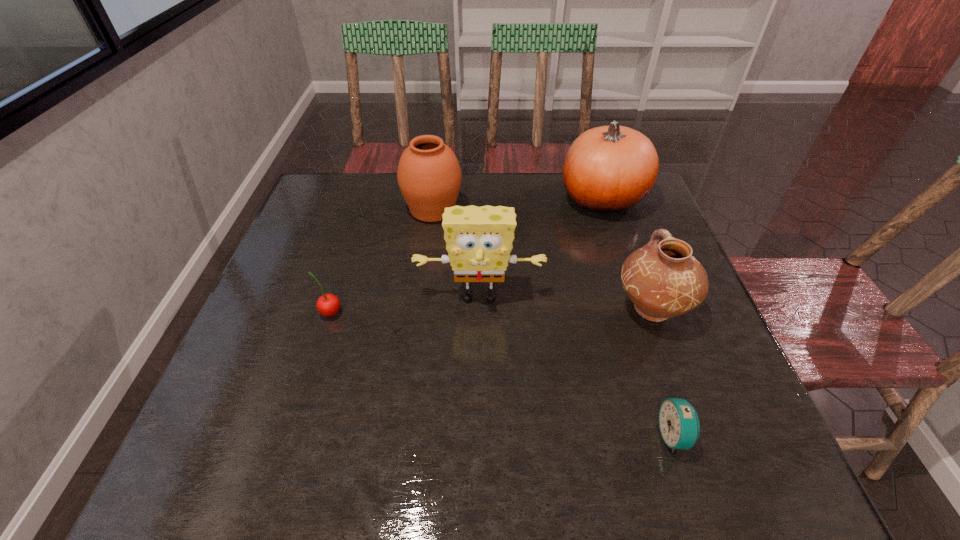
At what (x,y) coordinates should I click in order to perform the action: click on object positioned at the left edge. Please return your answer as a coordinate pair (x, y). This screenshot has height=540, width=960. Looking at the image, I should click on (328, 304).

The width and height of the screenshot is (960, 540). I want to click on pumpkin that is positioned at the right edge, so click(x=607, y=169).

The height and width of the screenshot is (540, 960). In order to click on pottery at the right edge in this screenshot , I will do `click(662, 279)`.

Locate an element on the screen. The image size is (960, 540). alarm clock that is at the right edge is located at coordinates (679, 424).

Find the location of `object at the far right corner`. object at the far right corner is located at coordinates (607, 169).

Locate an element on the screen. object present at the near right corner is located at coordinates (679, 424).

Where is `free space at the far edge of the desktop`? This screenshot has height=540, width=960. free space at the far edge of the desktop is located at coordinates (491, 187).

I want to click on free spot at the near edge of the desktop, so click(x=670, y=482).

The image size is (960, 540). I want to click on vacant space at the left edge of the desktop, so click(299, 241).

You are a GUI agent. You are given a task and a screenshot of the screen. Output one action in this format:
    pyautogui.click(x=<x>, y=<y>)
    Task: Click on the free space at the right edge
    Image resolution: width=960 pixels, height=540 pixels.
    Given the screenshot: What is the action you would take?
    pyautogui.click(x=718, y=427)